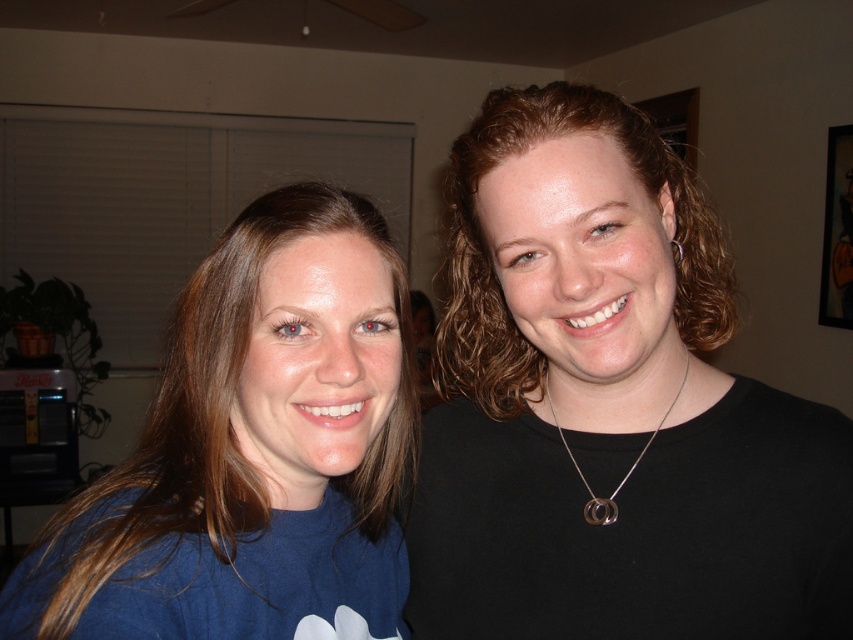
How far apart are black matte shirt at right and silver metallic earring at upper right?

black matte shirt at right is 8.05 inches away from silver metallic earring at upper right.

Does black matte shirt at right appear over silver metallic earring at upper right?

No.

Is point (662, 253) farther from camera compared to point (682, 250)?

No.

Image resolution: width=853 pixels, height=640 pixels. What are the coordinates of `black matte shirt at right` in the screenshot? It's located at (608, 404).

Is point (595, 513) closer to viewer compared to point (679, 248)?

Yes, it is.

What are the coordinates of `silver/metallic necklace at center` in the screenshot? It's located at [627, 468].

Looking at this image, who is more distant from viewer, (x=549, y=406) or (x=682, y=252)?

The point (x=549, y=406) is more distant.

Where is `silver/metallic necklace at center`? The height and width of the screenshot is (640, 853). silver/metallic necklace at center is located at coordinates (627, 468).

Does point (120, 634) come in front of point (595, 496)?

Yes, it is.

Can you confirm if blue matte shirt at left is taller than silver/metallic necklace at center?

Yes, blue matte shirt at left is taller than silver/metallic necklace at center.

Between point (231, 538) and point (666, 412), which one is positioned behind?

Point (666, 412)

Find the location of a particular element. This screenshot has width=853, height=640. blue matte shirt at left is located at coordinates (253, 451).